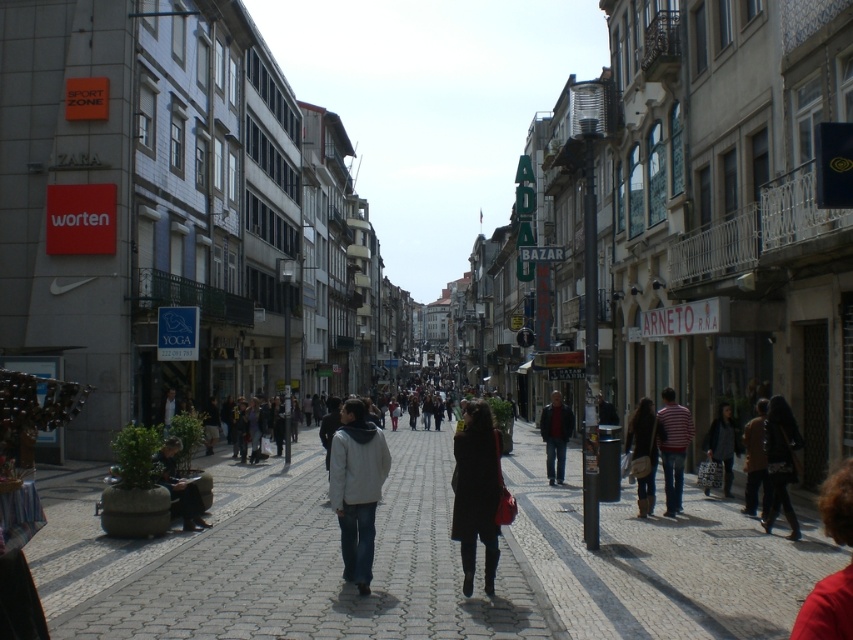
Question: Can you confirm if light gray jacket at center is bigger than brown leather jacket at center?

Choices:
 (A) yes
 (B) no

Answer: (B)

Question: Which of the following is the farthest from the observer?

Choices:
 (A) (56, 579)
 (B) (485, 540)
 (C) (677, 406)

Answer: (C)

Question: Among these points, which one is nearest to the camera?

Choices:
 (A) (653, 444)
 (B) (717, 428)
 (C) (793, 518)
 (D) (502, 561)

Answer: (D)

Question: Can you confirm if gray cobblestone pavement at center is smaller than dark brown hair at lower right?

Choices:
 (A) no
 (B) yes

Answer: (A)

Question: Is black matte coat at center closer to camera compared to brown leather boots at lower right?

Choices:
 (A) yes
 (B) no

Answer: (A)

Question: Which object is positioned closest to the matte black jacket at lower left?

Choices:
 (A) gray cobblestone pavement at center
 (B) brown leather jacket at center
 (C) dark brown leather jacket at lower right

Answer: (A)